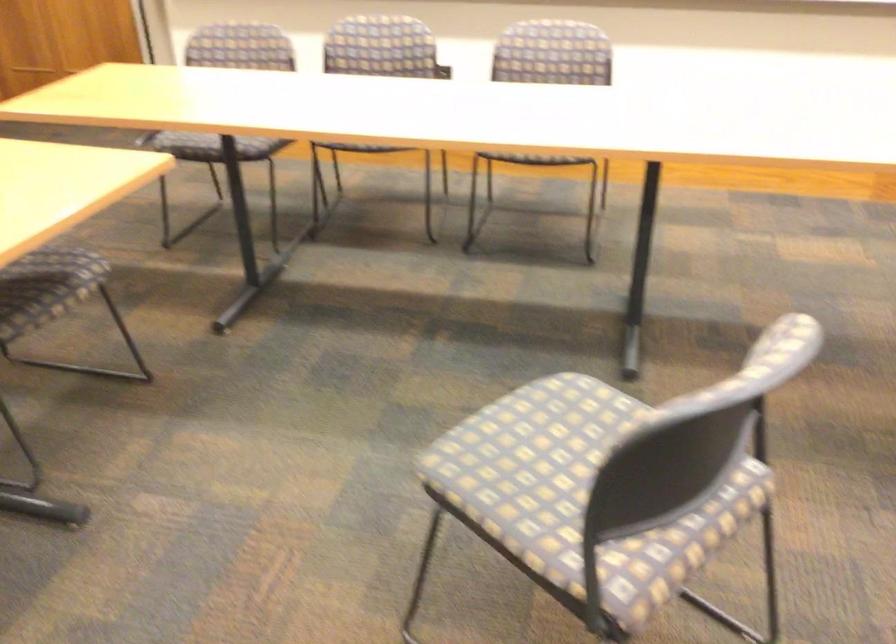
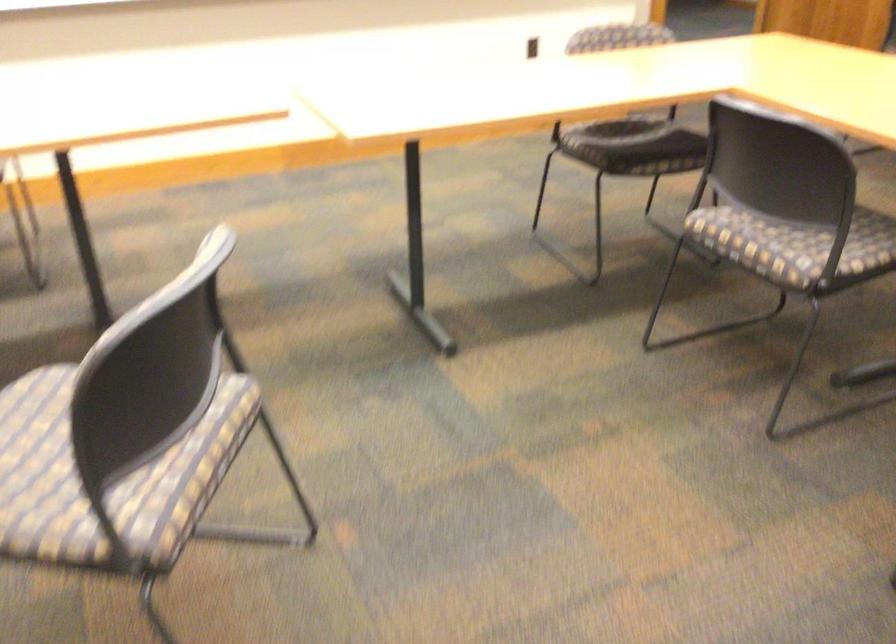
Question: The images are taken continuously from a first-person perspective. In which direction is your viewpoint rotating?

Choices:
 (A) Left
 (B) Right
 (C) Up
 (D) Down

Answer: (B)